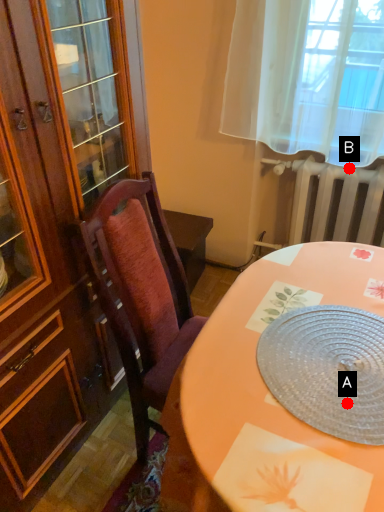
Question: Two points are circled on the image, labeled by A and B beside each circle. Which of the following is the closest to the observer?

Choices:
 (A) A is closer
 (B) B is closer

Answer: (A)